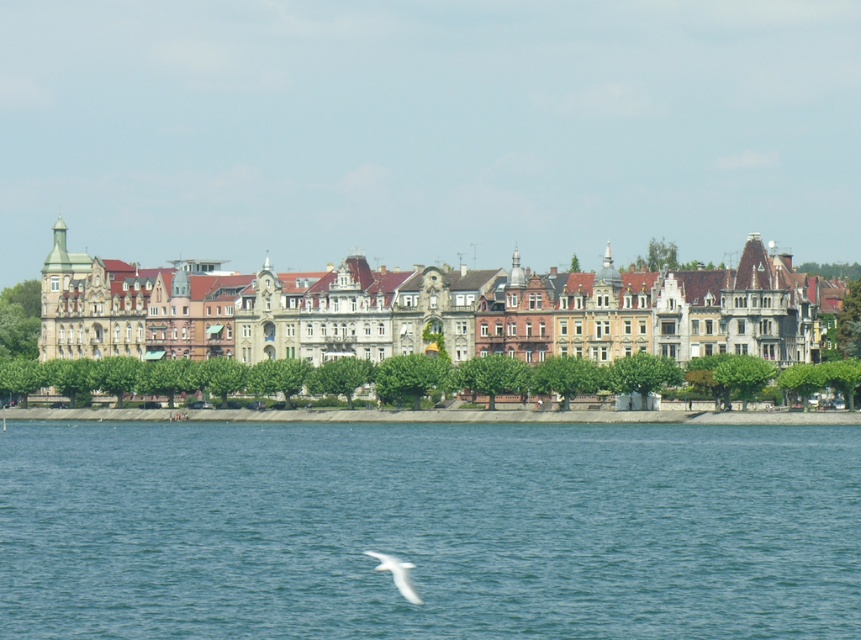
You are standing at a waterfront with ornate European buildings in the background. There is a point marked at coordinates point (x=10, y=609). If you want to take a photo of this point from where you are standing, will you be able to capture it in your camera frame? Consider the distance between the point and the camera is 74.48 meters.

The point (x=10, y=609) is 74.48 meters away from the camera. Since the distance is within the camera range, you can capture it in your camera frame.

You are an artist planning to paint this waterfront scene. You want to ensure the blue water at lower center and the white feathered bird at lower center are proportionally accurate. Which object should you paint first to maintain their size relationship?

The blue water at lower center should be painted first since it is larger than the white feathered bird at lower center, allowing you to establish the correct size relationship between them.